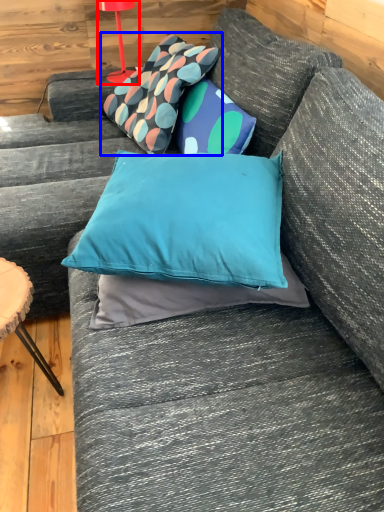
Question: Which point is closer to the camera, table lamp (highlighted by a red box) or pillow (highlighted by a blue box)?

Choices:
 (A) table lamp
 (B) pillow

Answer: (B)